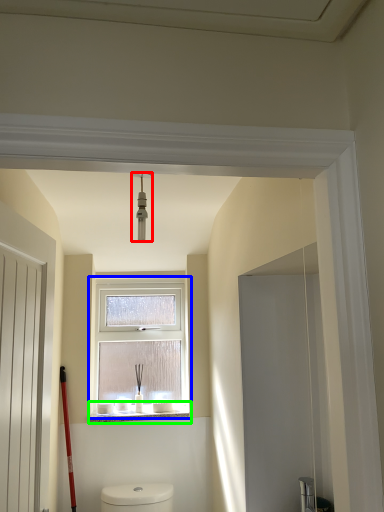
Question: Which object is positioned closest to light fixture (highlighted by a red box)? Select from window (highlighted by a blue box) and window sill (highlighted by a green box).

Choices:
 (A) window
 (B) window sill

Answer: (A)